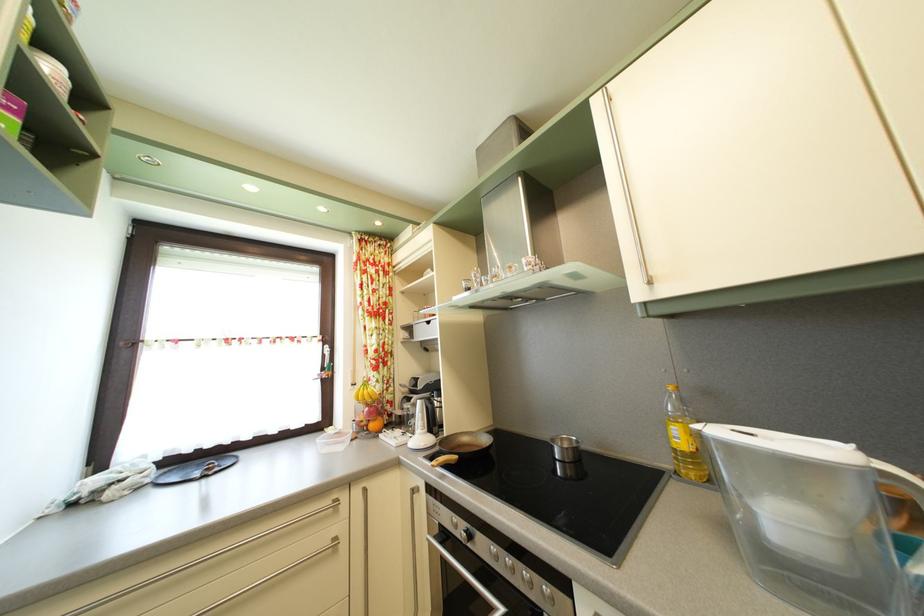
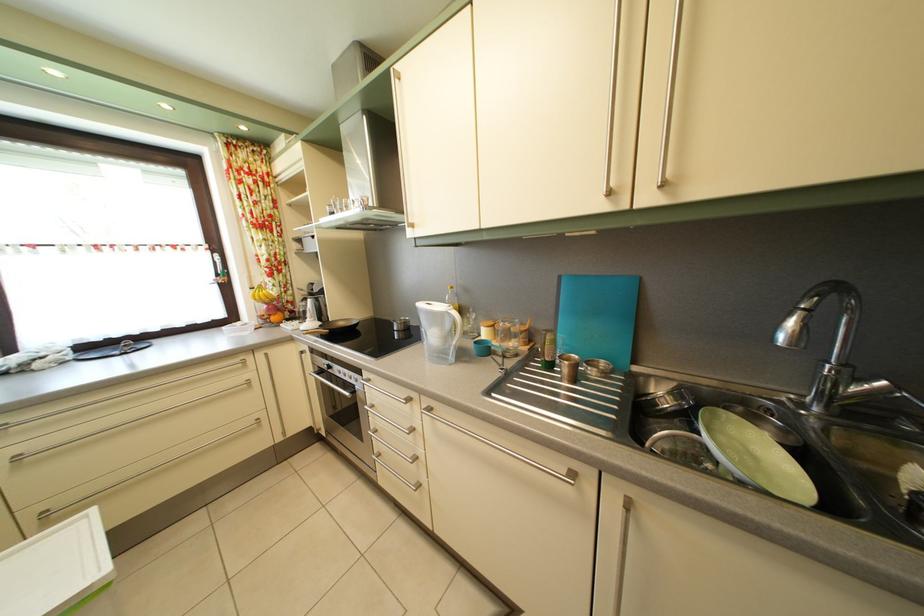
Find the pixel in the second image that matches [365,498] in the first image.

(268, 363)